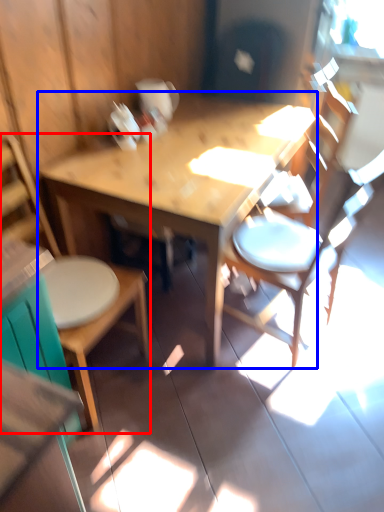
Question: Which of the following is the closest to the observer, chair (highlighted by a red box) or table (highlighted by a blue box)?

Choices:
 (A) chair
 (B) table

Answer: (A)